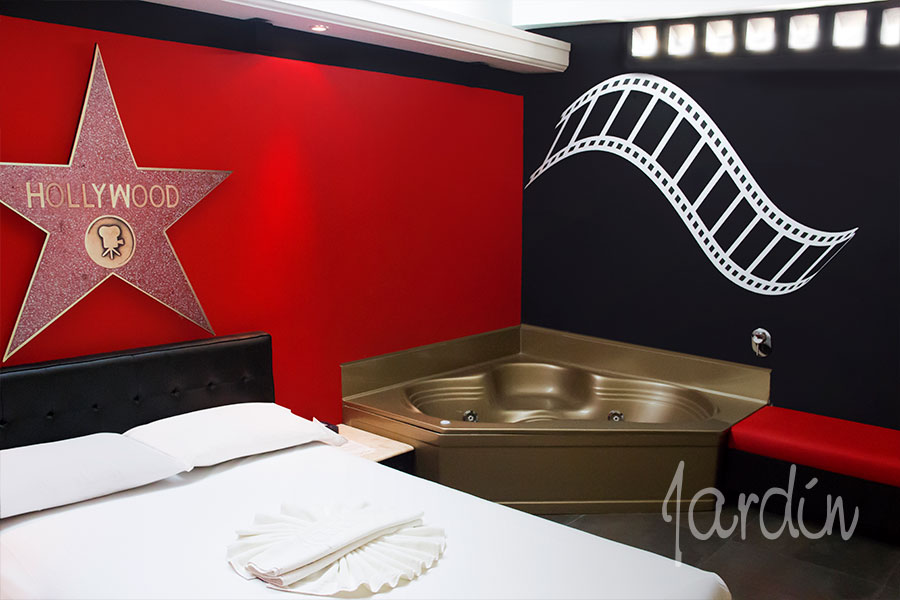
Where is `bench`? Image resolution: width=900 pixels, height=600 pixels. bench is located at coordinates (846, 454).